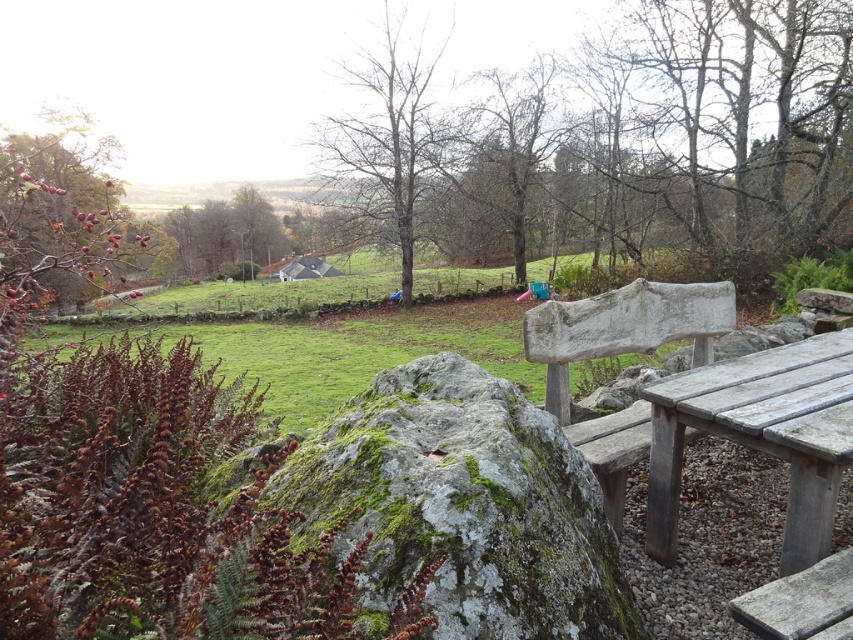
You are planning to set up a small garden in your backyard. You have both the green mossy rock at center and the weathered wood picnic table at lower right. Which object should you place lower to the ground to match their natural positioning?

The green mossy rock at center should be placed lower to the ground since it is not as tall as the weathered wood picnic table at lower right.

You are standing at the point labeled as point (340, 348) in the image. Looking around, what do you see immediately around you?

You are standing in the green grassy field at center, as the point (340, 348) corresponds to that location.

You are a gardener who needs to place a 1.2 meter long garden hose between the green mossy rock at center and the nearest leafless tree. Can you fit the hose between them without bending it?

The distance between the green mossy rock at center and the nearest leafless tree is 1.08 meters, which is shorter than the 1.2 meter hose. Therefore, the hose cannot be placed straight between them without bending it.